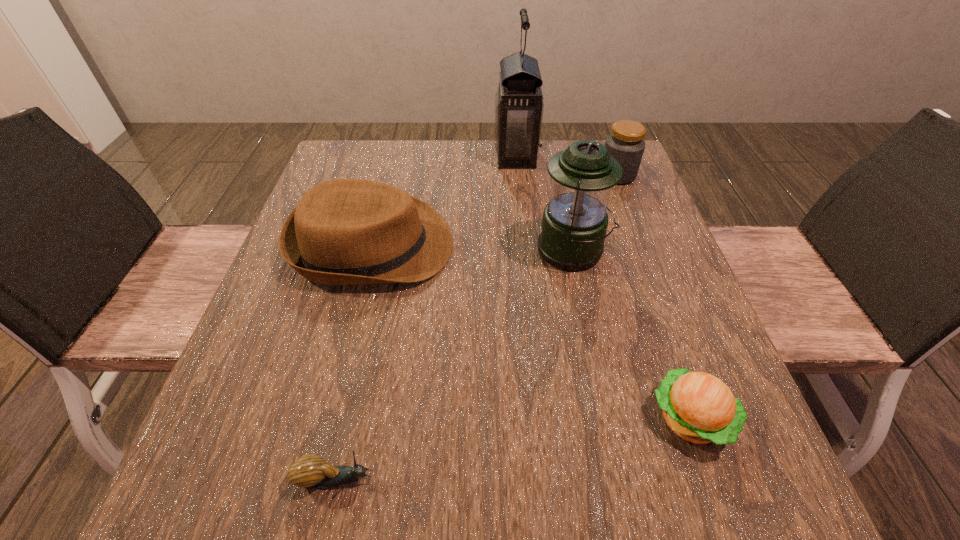
At what (x,y) coordinates should I click in order to perform the action: click on the farther lantern. Please return your answer as a coordinate pair (x, y). This screenshot has height=540, width=960. Looking at the image, I should click on (519, 105).

What are the coordinates of `the taller lantern` in the screenshot? It's located at (519, 105).

The height and width of the screenshot is (540, 960). In order to click on the second tallest object in this screenshot , I will do `click(574, 223)`.

You are a GUI agent. You are given a task and a screenshot of the screen. Output one action in this format:
    pyautogui.click(x=<x>, y=<y>)
    Task: Click on the shorter lantern
    
    Given the screenshot: What is the action you would take?
    pyautogui.click(x=574, y=223)

You are a GUI agent. You are given a task and a screenshot of the screen. Output one action in this format:
    pyautogui.click(x=<x>, y=<y>)
    Task: Click on the jar
    The image size is (960, 540).
    Given the screenshot: What is the action you would take?
    pyautogui.click(x=625, y=144)

Image resolution: width=960 pixels, height=540 pixels. Find the location of `fedora`. fedora is located at coordinates (346, 231).

Image resolution: width=960 pixels, height=540 pixels. I want to click on the second nearest object, so (700, 408).

Locate an element on the screen. This screenshot has width=960, height=540. the fifth tallest object is located at coordinates 700,408.

Identify the location of escargot. (311, 471).

Image resolution: width=960 pixels, height=540 pixels. What are the coordinates of `the nearest object` in the screenshot? It's located at (311, 471).